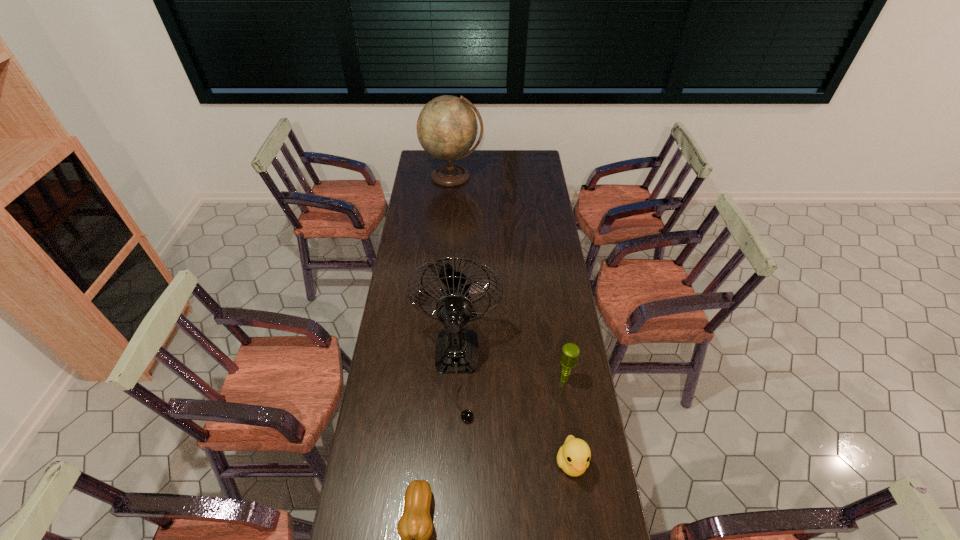
What are the coordinates of `globe` in the screenshot? It's located at (447, 127).

The width and height of the screenshot is (960, 540). What are the coordinates of `fan` in the screenshot? It's located at (456, 351).

Find the location of a particular element. Image resolution: width=960 pixels, height=540 pixels. the third shortest object is located at coordinates (569, 357).

In order to click on the second nearest object in this screenshot , I will do `click(573, 457)`.

You are a GUI agent. You are given a task and a screenshot of the screen. Output one action in this format:
    pyautogui.click(x=<x>, y=<y>)
    Task: Click on the duck
    Image resolution: width=960 pixels, height=540 pixels.
    Given the screenshot: What is the action you would take?
    pyautogui.click(x=573, y=457)

At what (x,y) coordinates should I click in order to perform the action: click on vacant space located on the front-facing side of the globe. Please return your answer as a coordinate pair (x, y). Looking at the image, I should click on (449, 215).

This screenshot has height=540, width=960. Identify the location of free space located in front of the fan, indicating the direction of air flow. (452, 454).

Where is `blank space located 0.340m on the back of the third tallest object`? blank space located 0.340m on the back of the third tallest object is located at coordinates (553, 303).

At what (x,y) coordinates should I click in order to perform the action: click on vacant space located on the face of the second shortest object. Please return your answer as a coordinate pair (x, y). The height and width of the screenshot is (540, 960). Looking at the image, I should click on (582, 532).

Identify the location of object that is at the far edge. The height and width of the screenshot is (540, 960). (447, 127).